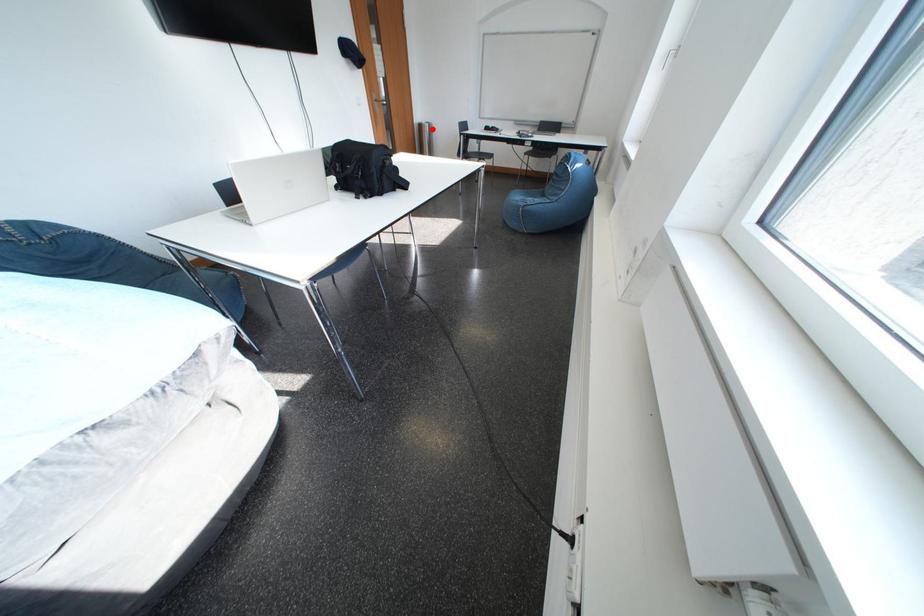
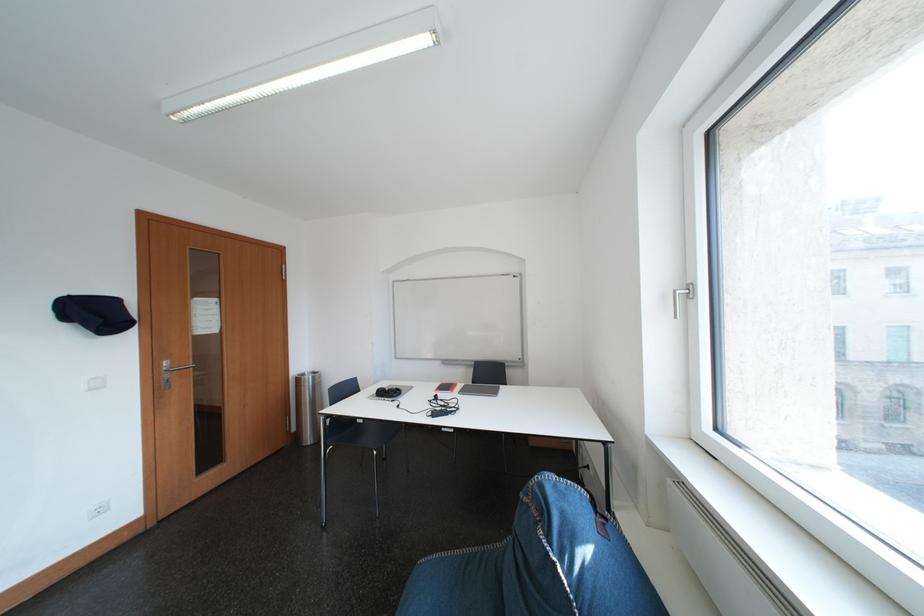
Locate, in the second image, the point that corresponds to the highlighted location in the first image.

(310, 383)